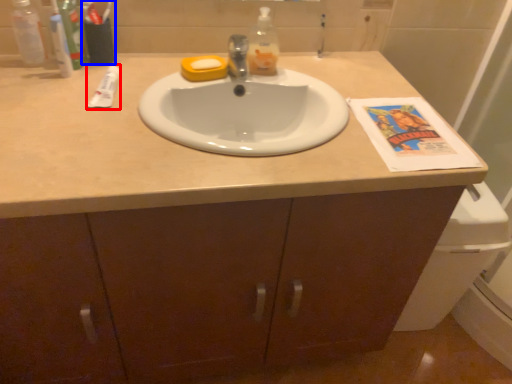
Question: Among these objects, which one is farthest to the camera, toothpaste (highlighted by a red box) or toiletry (highlighted by a blue box)?

Choices:
 (A) toothpaste
 (B) toiletry

Answer: (B)